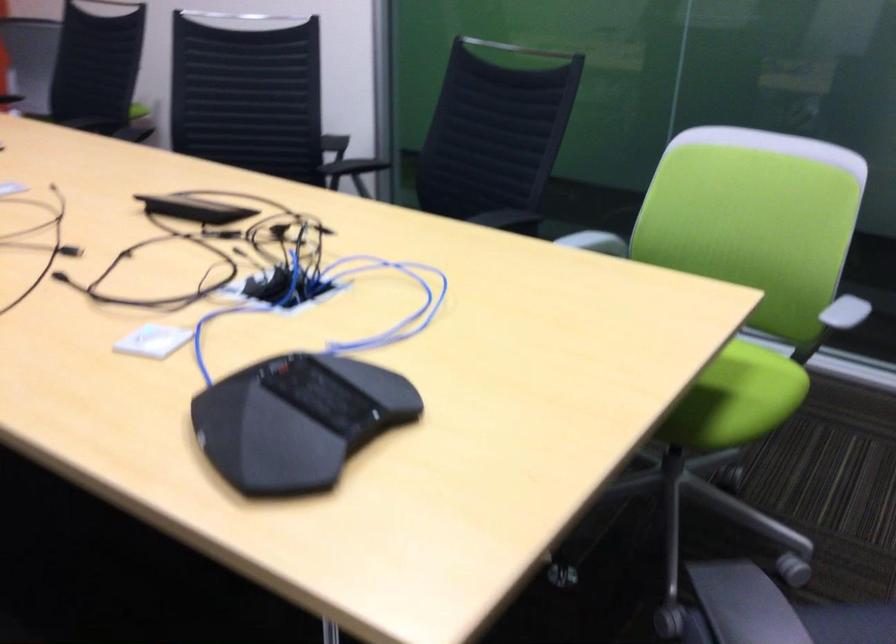
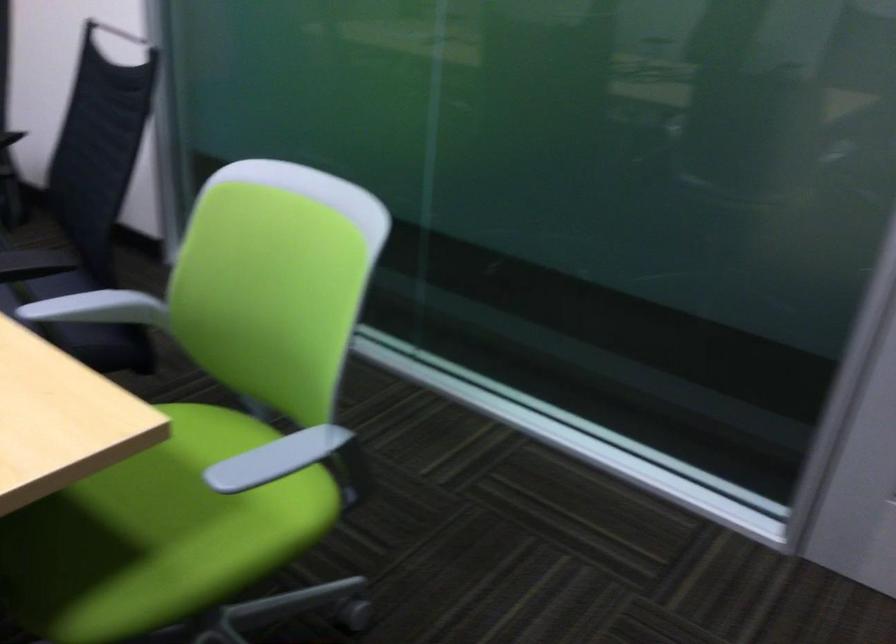
What movement of the cameraman would produce the second image?

The movement direction of the cameraman is right, forward.